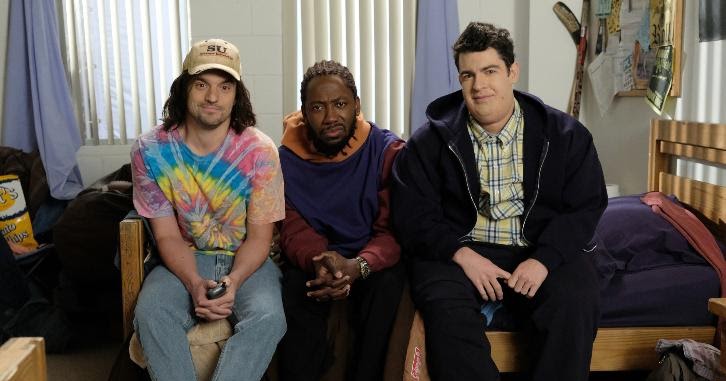
This screenshot has height=381, width=726. I want to click on bed frame, so click(x=677, y=133), click(x=709, y=133), click(x=679, y=182), click(x=706, y=191), click(x=605, y=339), click(x=499, y=346), click(x=412, y=357), click(x=129, y=240), click(x=133, y=278), click(x=27, y=354).